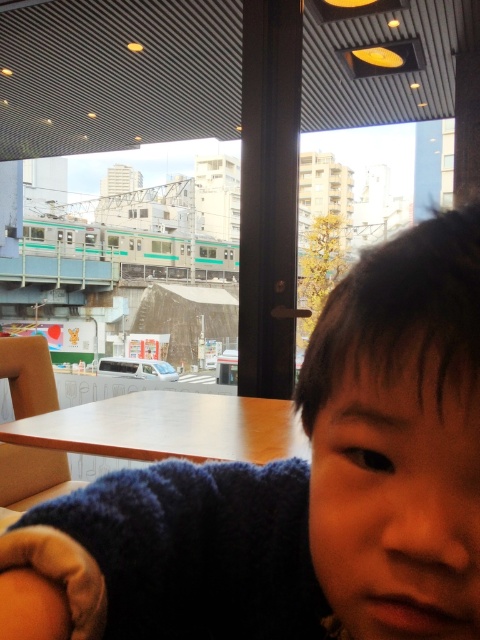
Between dark blue sweater at center and wooden table at center, which one appears on the left side from the viewer's perspective?

From the viewer's perspective, wooden table at center appears more on the left side.

Between point (81, 576) and point (100, 413), which one is positioned in front?

Positioned in front is point (81, 576).

I want to click on dark blue sweater at center, so click(x=298, y=490).